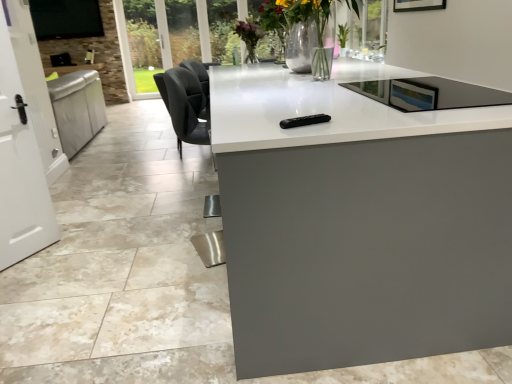
Question: Should I look upward or downward to see black glass tv at upper left?

Choices:
 (A) down
 (B) up

Answer: (B)

Question: Considering the relative positions of white glossy countertop at center and translucent glass vase at center in the image provided, is white glossy countertop at center to the right of translucent glass vase at center from the viewer's perspective?

Choices:
 (A) yes
 (B) no

Answer: (B)

Question: Is white glossy countertop at center directly adjacent to translucent glass vase at center?

Choices:
 (A) no
 (B) yes

Answer: (A)

Question: Is white glossy countertop at center taller than translucent glass vase at center?

Choices:
 (A) no
 (B) yes

Answer: (A)

Question: Considering the relative positions of white glossy countertop at center and translucent glass vase at center in the image provided, is white glossy countertop at center to the left of translucent glass vase at center from the viewer's perspective?

Choices:
 (A) no
 (B) yes

Answer: (B)

Question: From a real-world perspective, is white glossy countertop at center located beneath translucent glass vase at center?

Choices:
 (A) yes
 (B) no

Answer: (A)

Question: Is white glossy countertop at center facing away from translucent glass vase at center?

Choices:
 (A) yes
 (B) no

Answer: (B)

Question: Does translucent glass vase at center have a lesser height compared to white glossy countertop at center?

Choices:
 (A) yes
 (B) no

Answer: (B)

Question: Is translucent glass vase at center at the left side of white glossy countertop at center?

Choices:
 (A) yes
 (B) no

Answer: (B)

Question: Is translucent glass vase at center surrounding white glossy countertop at center?

Choices:
 (A) yes
 (B) no

Answer: (B)

Question: Are translucent glass vase at center and white glossy countertop at center making contact?

Choices:
 (A) yes
 (B) no

Answer: (B)

Question: From a real-world perspective, is translucent glass vase at center physically above white glossy countertop at center?

Choices:
 (A) yes
 (B) no

Answer: (A)

Question: Is translucent glass vase at center at the right side of white glossy countertop at center?

Choices:
 (A) yes
 (B) no

Answer: (A)

Question: Is black glass tv at upper left with white glossy door at left?

Choices:
 (A) no
 (B) yes

Answer: (A)